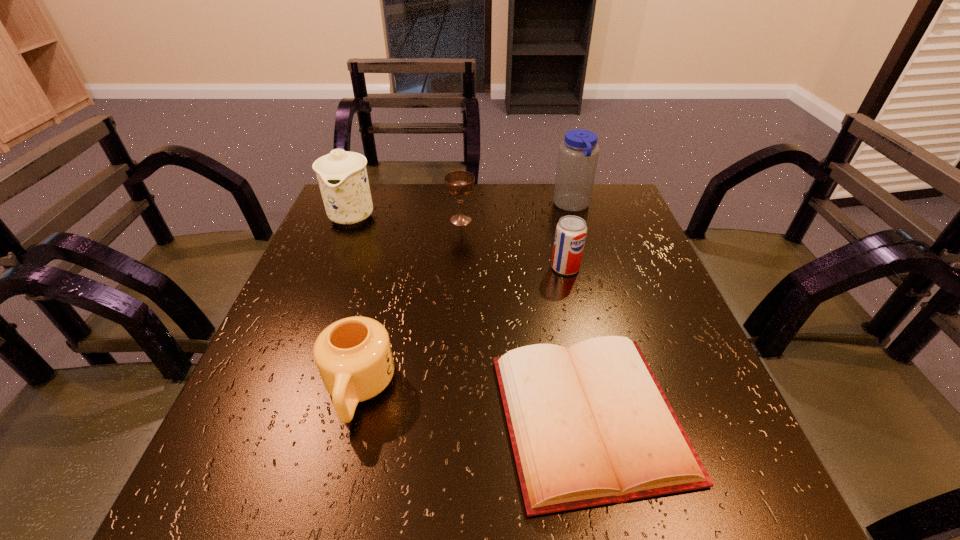
I want to click on water bottle, so click(x=578, y=154).

The height and width of the screenshot is (540, 960). Identify the location of chinaware. (342, 176).

Where is `the fourth object from right to left`? the fourth object from right to left is located at coordinates (459, 183).

What are the coordinates of `the fourth farthest object` in the screenshot? It's located at (570, 235).

Find the location of a particular element. the second object from left to right is located at coordinates (353, 355).

Where is `Bible`? This screenshot has height=540, width=960. Bible is located at coordinates (591, 425).

You are a GUI agent. You are given a task and a screenshot of the screen. Output one action in this format:
    pyautogui.click(x=<x>, y=<y>)
    Task: Click on the free location located 0.070m with a carrying loop on the side of the water bottle
    
    Given the screenshot: What is the action you would take?
    pyautogui.click(x=528, y=206)

At what (x,y) coordinates should I click in order to perform the action: click on free spot located 0.090m with a carrying loop on the side of the water bottle. Please return your answer as a coordinate pair (x, y). Image resolution: width=960 pixels, height=540 pixels. Looking at the image, I should click on (521, 206).

The width and height of the screenshot is (960, 540). In order to click on free space located 0.310m with a carrying loop on the side of the water bottle in this screenshot , I will do `click(444, 206)`.

The width and height of the screenshot is (960, 540). Find the location of `free space located 0.250m on the spout of the leftmost object`. free space located 0.250m on the spout of the leftmost object is located at coordinates (318, 304).